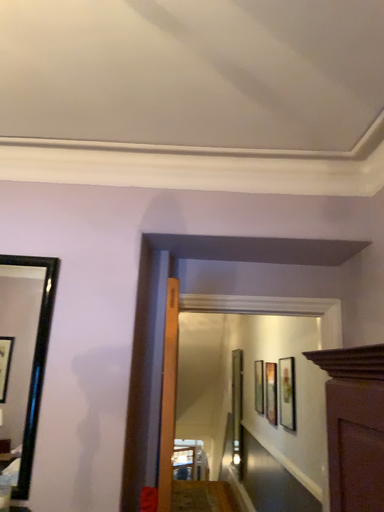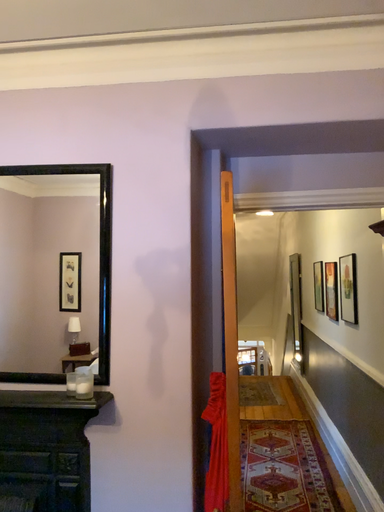
Question: Which way did the camera rotate in the video?

Choices:
 (A) rotated upward
 (B) rotated downward

Answer: (B)